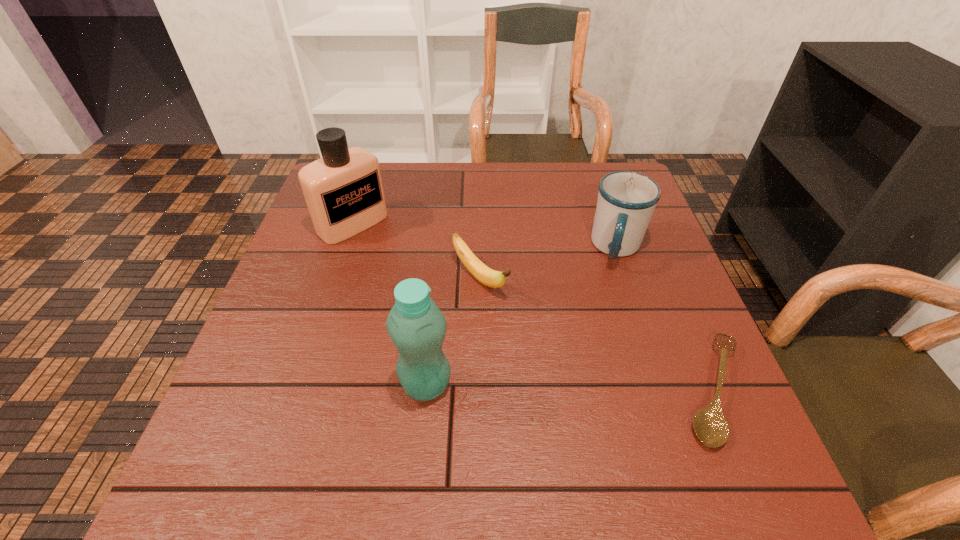
You are a GUI agent. You are given a task and a screenshot of the screen. Output one action in this format:
    pyautogui.click(x=<x>, y=<y>)
    Task: Click on the ladle at the right edge
    The image size is (960, 540).
    Given the screenshot: What is the action you would take?
    pyautogui.click(x=710, y=425)

You are a GUI agent. You are given a task and a screenshot of the screen. Output one action in this format:
    pyautogui.click(x=<x>, y=<y>)
    Task: Click on the mug situated at the right edge
    
    Given the screenshot: What is the action you would take?
    pyautogui.click(x=626, y=201)

At what (x,y) coordinates should I click in order to perform the action: click on object positioned at the far left corner. Please return your answer as a coordinate pair (x, y). Looking at the image, I should click on (343, 190).

Locate an element on the screen. The height and width of the screenshot is (540, 960). object positioned at the near right corner is located at coordinates (710, 425).

You are a GUI agent. You are given a task and a screenshot of the screen. Output one action in this format:
    pyautogui.click(x=<x>, y=<y>)
    Task: Click on the vacant area at the far edge of the desktop
    
    Given the screenshot: What is the action you would take?
    pyautogui.click(x=511, y=188)

I want to click on free space at the left edge, so click(x=273, y=307).

Find the location of a particular element. This screenshot has width=960, height=540. free space at the right edge of the desktop is located at coordinates (660, 260).

The height and width of the screenshot is (540, 960). In the image, there is a desktop. Identify the location of free region at the near left corner. click(x=299, y=411).

The image size is (960, 540). In the image, there is a desktop. Identify the location of vacant area at the far right corner. (583, 167).

Image resolution: width=960 pixels, height=540 pixels. In the image, there is a desktop. Identify the location of vacant space at the near right corner. (679, 408).